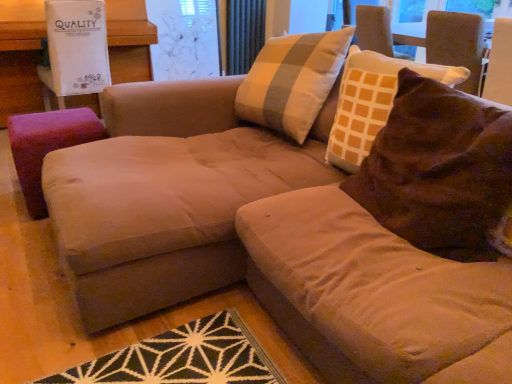
Question: Is dark gray metallic radiator at upper center positioned in front of transparent plastic screen at upper center?

Choices:
 (A) no
 (B) yes

Answer: (A)

Question: From the image's perspective, is dark gray metallic radiator at upper center beneath transparent plastic screen at upper center?

Choices:
 (A) no
 (B) yes

Answer: (A)

Question: Considering the relative sizes of dark gray metallic radiator at upper center and transparent plastic screen at upper center in the image provided, is dark gray metallic radiator at upper center smaller than transparent plastic screen at upper center?

Choices:
 (A) yes
 (B) no

Answer: (A)

Question: From a real-world perspective, does dark gray metallic radiator at upper center stand above transparent plastic screen at upper center?

Choices:
 (A) yes
 (B) no

Answer: (A)

Question: Does dark gray metallic radiator at upper center have a lesser height compared to transparent plastic screen at upper center?

Choices:
 (A) no
 (B) yes

Answer: (B)

Question: Is purple fabric stool at left in front of or behind suede beige couch at center in the image?

Choices:
 (A) front
 (B) behind

Answer: (B)

Question: Looking at the image, does purple fabric stool at left seem bigger or smaller compared to suede beige couch at center?

Choices:
 (A) big
 (B) small

Answer: (B)

Question: Is point (18, 145) positioned closer to the camera than point (458, 377)?

Choices:
 (A) farther
 (B) closer

Answer: (A)

Question: In terms of height, does purple fabric stool at left look taller or shorter compared to suede beige couch at center?

Choices:
 (A) short
 (B) tall

Answer: (A)

Question: Does point (0, 102) appear closer or farther from the camera than point (182, 3)?

Choices:
 (A) farther
 (B) closer

Answer: (B)

Question: In terms of height, does pink fabric ottoman at left look taller or shorter compared to transparent plastic screen at upper center?

Choices:
 (A) tall
 (B) short

Answer: (A)

Question: Is pink fabric ottoman at left wider or thinner than transparent plastic screen at upper center?

Choices:
 (A) thin
 (B) wide

Answer: (B)

Question: In the image, is pink fabric ottoman at left positioned in front of or behind transparent plastic screen at upper center?

Choices:
 (A) behind
 (B) front

Answer: (B)

Question: Is suede beige couch at center wider or thinner than brown velvety throw pillow at upper right?

Choices:
 (A) wide
 (B) thin

Answer: (A)

Question: Is suede beige couch at center situated inside brown velvety throw pillow at upper right or outside?

Choices:
 (A) outside
 (B) inside

Answer: (A)